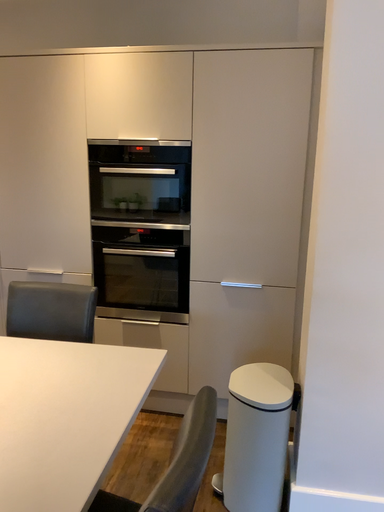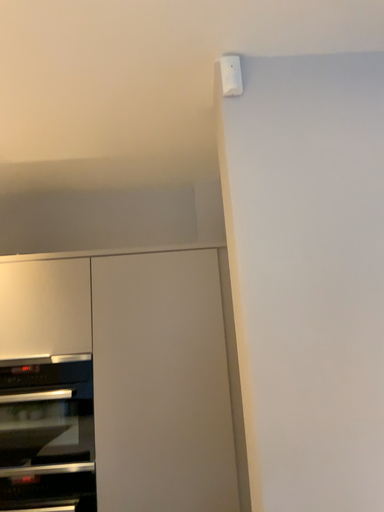
Question: How did the camera likely rotate when shooting the video?

Choices:
 (A) rotated upward
 (B) rotated downward

Answer: (A)